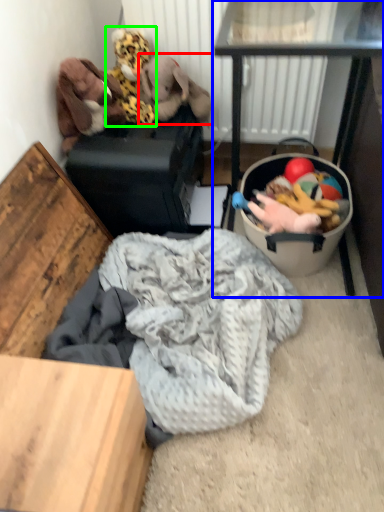
Question: Estimate the real-world distances between objects in this image. Which object is farther from animal (highlighted by a red box), table (highlighted by a blue box) or toy (highlighted by a green box)?

Choices:
 (A) table
 (B) toy

Answer: (A)